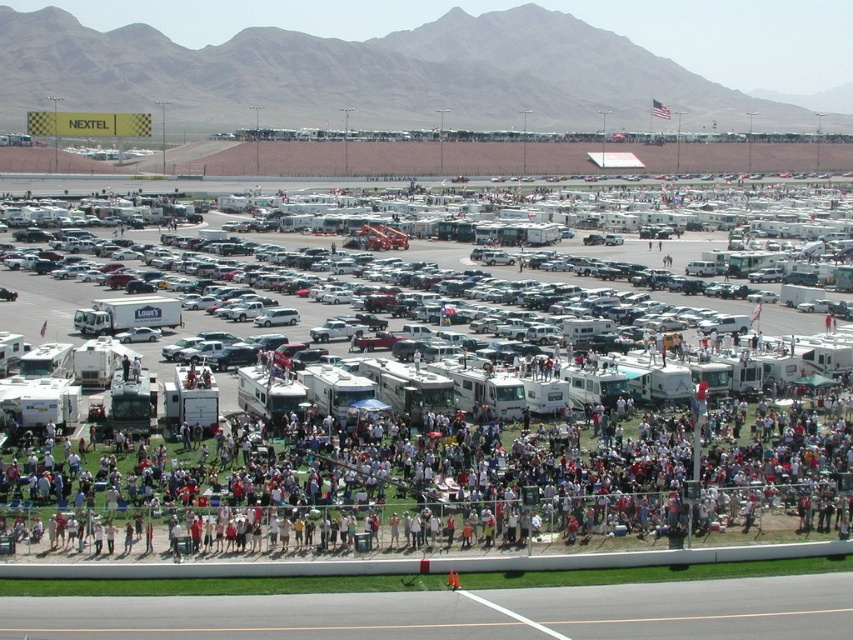
What do you see at coordinates (494, 481) in the screenshot? The width and height of the screenshot is (853, 640). I see `white matte rv at center` at bounding box center [494, 481].

Based on the photo, is white matte rv at center positioned behind white matte recreational vehicle at center?

No, it is in front of white matte recreational vehicle at center.

This screenshot has width=853, height=640. Find the location of `white matte rv at center`. white matte rv at center is located at coordinates (494, 481).